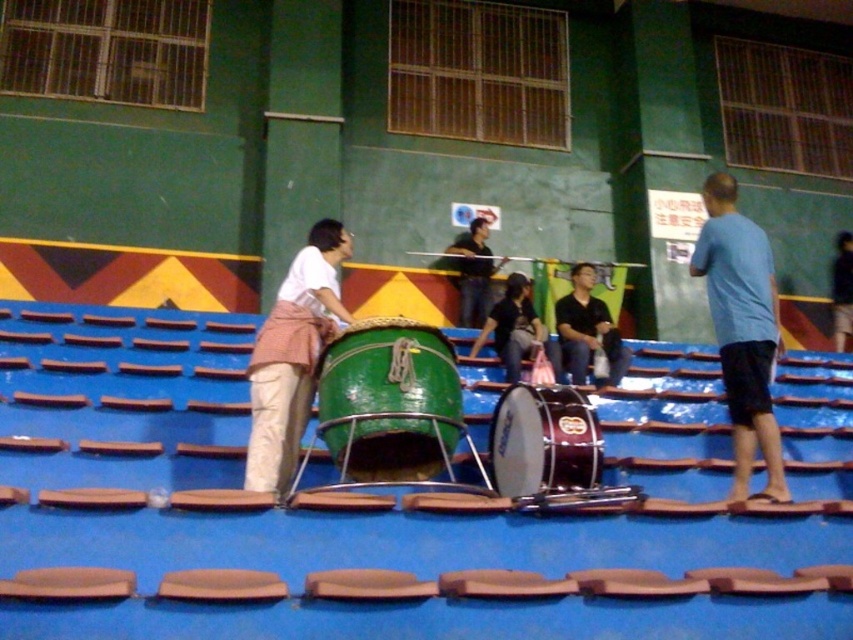
Question: Does shiny brown drum at center appear on the left side of black fabric shirt at center?

Choices:
 (A) yes
 (B) no

Answer: (A)

Question: Can you confirm if matte pink skirt at center is positioned to the left of black fabric shirt at center?

Choices:
 (A) yes
 (B) no

Answer: (A)

Question: Considering the relative positions of black matte shirt at center and matte black shirt at center in the image provided, where is black matte shirt at center located with respect to matte black shirt at center?

Choices:
 (A) below
 (B) above

Answer: (A)

Question: Which point is farther to the camera?

Choices:
 (A) shiny brown drum at center
 (B) black matte shirt at center
 (C) matte black shirt at center
 (D) green wooden drum at center

Answer: (C)

Question: Which point is closer to the camera taking this photo?

Choices:
 (A) (543, 476)
 (B) (398, 467)
 (C) (526, 317)

Answer: (A)

Question: Which point appears closest to the camera in this image?

Choices:
 (A) (552, 483)
 (B) (374, 356)
 (C) (579, 320)
 (D) (325, 316)

Answer: (B)